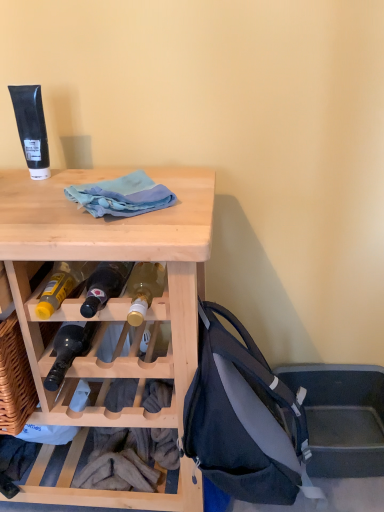
What are the coordinates of `vacant space behind light blue fabric at center` in the screenshot? It's located at (145, 169).